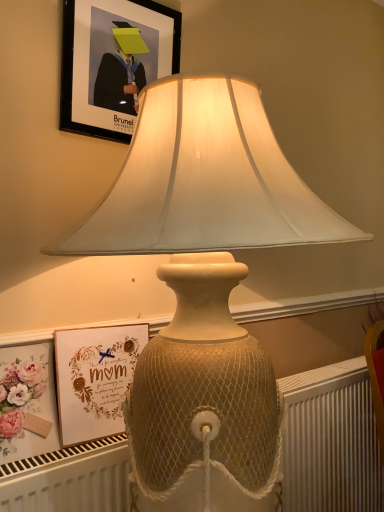
Question: From the image's perspective, is matte gold picture frame at lower left, the first picture frame from the bottom, over white textured radiator at lower center?

Choices:
 (A) yes
 (B) no

Answer: (A)

Question: Does matte gold picture frame at lower left, positioned as the 2th picture frame in top-to-bottom order, have a greater width compared to white textured radiator at lower center?

Choices:
 (A) no
 (B) yes

Answer: (A)

Question: Is white textured radiator at lower center located within matte gold picture frame at lower left, the first picture frame from the bottom?

Choices:
 (A) yes
 (B) no

Answer: (B)

Question: Is matte gold picture frame at lower left, positioned as the 2th picture frame in top-to-bottom order, to the right of white textured radiator at lower center from the viewer's perspective?

Choices:
 (A) no
 (B) yes

Answer: (A)

Question: From the image's perspective, does matte gold picture frame at lower left, positioned as the 2th picture frame in top-to-bottom order, appear lower than white textured radiator at lower center?

Choices:
 (A) no
 (B) yes

Answer: (A)

Question: Does matte gold picture frame at lower left, positioned as the 2th picture frame in top-to-bottom order, have a lesser height compared to white textured radiator at lower center?

Choices:
 (A) yes
 (B) no

Answer: (A)

Question: Does black matte picture frame at upper center, the second picture frame in the bottom-to-top sequence, have a greater width compared to matte gold picture frame at lower left, the first picture frame from the bottom?

Choices:
 (A) no
 (B) yes

Answer: (A)

Question: From the image's perspective, is black matte picture frame at upper center, the first picture frame in the top-to-bottom sequence, beneath matte gold picture frame at lower left, the first picture frame from the bottom?

Choices:
 (A) no
 (B) yes

Answer: (A)

Question: Considering the relative positions of black matte picture frame at upper center, the first picture frame in the top-to-bottom sequence, and matte gold picture frame at lower left, positioned as the 2th picture frame in top-to-bottom order, in the image provided, is black matte picture frame at upper center, the first picture frame in the top-to-bottom sequence, to the right of matte gold picture frame at lower left, positioned as the 2th picture frame in top-to-bottom order, from the viewer's perspective?

Choices:
 (A) no
 (B) yes

Answer: (B)

Question: Is black matte picture frame at upper center, the second picture frame in the bottom-to-top sequence, positioned before matte gold picture frame at lower left, positioned as the 2th picture frame in top-to-bottom order?

Choices:
 (A) yes
 (B) no

Answer: (B)

Question: From a real-world perspective, is black matte picture frame at upper center, the second picture frame in the bottom-to-top sequence, on matte gold picture frame at lower left, positioned as the 2th picture frame in top-to-bottom order?

Choices:
 (A) no
 (B) yes

Answer: (B)

Question: Does black matte picture frame at upper center, the first picture frame in the top-to-bottom sequence, have a larger size compared to matte gold picture frame at lower left, positioned as the 2th picture frame in top-to-bottom order?

Choices:
 (A) yes
 (B) no

Answer: (B)

Question: Is matte gold picture frame at lower left, positioned as the 2th picture frame in top-to-bottom order, turned away from black matte picture frame at upper center, the first picture frame in the top-to-bottom sequence?

Choices:
 (A) no
 (B) yes

Answer: (A)